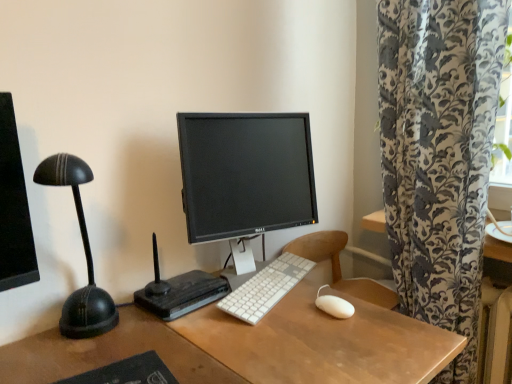
Question: Looking at their shapes, would you say black glossy monitor at center is wider or thinner than black rubber mousepad at lower left?

Choices:
 (A) wide
 (B) thin

Answer: (B)

Question: Do you think black glossy monitor at center is within black rubber mousepad at lower left, or outside of it?

Choices:
 (A) outside
 (B) inside

Answer: (A)

Question: Estimate the real-world distances between objects in this image. Which object is farther from the white plastic keyboard at center?

Choices:
 (A) black rubber mousepad at lower left
 (B) black glossy monitor at center
 (C) black plastic router at center
 (D) white matte mouse at center

Answer: (A)

Question: Considering the real-world distances, which object is closest to the white matte mouse at center?

Choices:
 (A) black plastic router at center
 (B) black glossy monitor at center
 (C) black rubber mousepad at lower left
 (D) white plastic keyboard at center

Answer: (D)